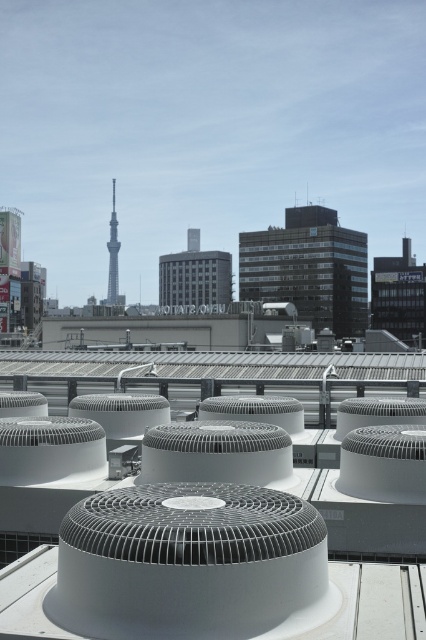
Which is below, silver metallic tower at center or gray concrete building at center?

Positioned lower is silver metallic tower at center.

Between point (111, 236) and point (198, 237), which one is positioned behind?

The point (111, 236) is behind.

Where is `silver metallic tower at center`? silver metallic tower at center is located at coordinates (112, 253).